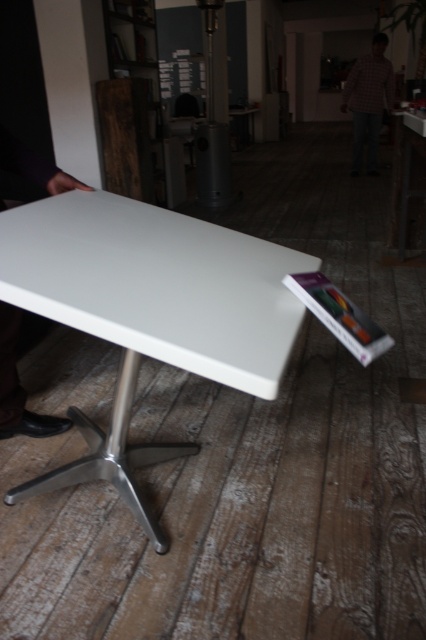
Is white glossy table at right positioned in front of checkered shirt at center?

That is True.

Which is in front, point (409, 212) or point (382, 93)?

Point (409, 212) is more forward.

Is point (397, 150) positioned in front of point (351, 84)?

Yes.

At what (x,y) coordinates should I click in order to perform the action: click on white glossy table at right. Please return your answer as a coordinate pair (x, y). Looking at the image, I should click on (408, 184).

Does white glossy table at center have a lesser height compared to white glossy table at right?

Correct, white glossy table at center is not as tall as white glossy table at right.

Which of these two, white glossy table at center or white glossy table at right, stands shorter?

With less height is white glossy table at center.

This screenshot has height=640, width=426. Identify the location of white glossy table at center. (149, 310).

Identify the location of white glossy table at center. (149, 310).

What do you see at coordinates (149, 310) in the screenshot?
I see `white glossy table at center` at bounding box center [149, 310].

Between white glossy table at center and checkered shirt at center, which one has less height?

Standing shorter between the two is white glossy table at center.

Identify the location of white glossy table at center. (149, 310).

This screenshot has height=640, width=426. What are the coordinates of `white glossy table at center` in the screenshot? It's located at point(149,310).